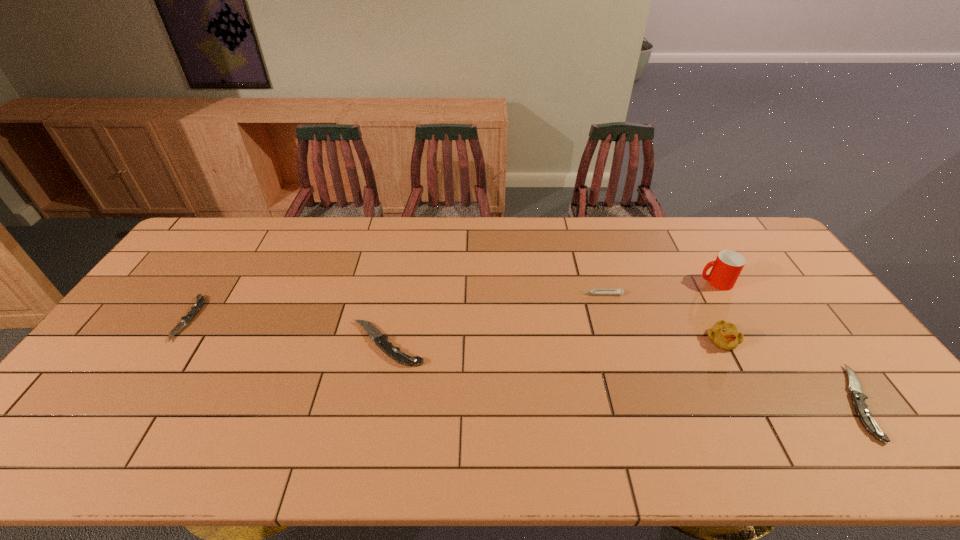
At what (x,y) coordinates should I click in order to perform the action: click on vacant space located on the right of the fifth object from right to left. Please return your answer as a coordinate pair (x, y). Image resolution: width=960 pixels, height=540 pixels. Looking at the image, I should click on (502, 343).

Find the location of a particular element. free location located on the left of the rightmost object is located at coordinates (792, 402).

You are a GUI agent. You are given a task and a screenshot of the screen. Output one action in this format:
    pyautogui.click(x=<x>, y=<y>)
    Task: Click on the blank space located on the side of the cup with the handle
    Image resolution: width=960 pixels, height=540 pixels.
    Given the screenshot: What is the action you would take?
    pyautogui.click(x=683, y=282)

Identify the location of vacant space located on the side of the cup with the handle. This screenshot has height=540, width=960. (670, 282).

Identify the location of vacant area situated on the side of the cup with the handle. This screenshot has height=540, width=960. (583, 282).

Locate an element on the screen. The image size is (960, 540). free space located on the front-facing side of the duckling is located at coordinates (746, 387).

Identify the location of blank space located at the needle end of the syringe. This screenshot has height=540, width=960. (529, 294).

In order to click on free region located 0.320m at the needle end of the syringe in this screenshot , I will do `click(474, 294)`.

Identify the location of free location located at the needle end of the syringe. This screenshot has height=540, width=960. (493, 294).

At what (x,y) coordinates should I click in order to perform the action: click on object that is at the near edge. Please return your answer as a coordinate pair (x, y). This screenshot has width=960, height=540. Looking at the image, I should click on (858, 398).